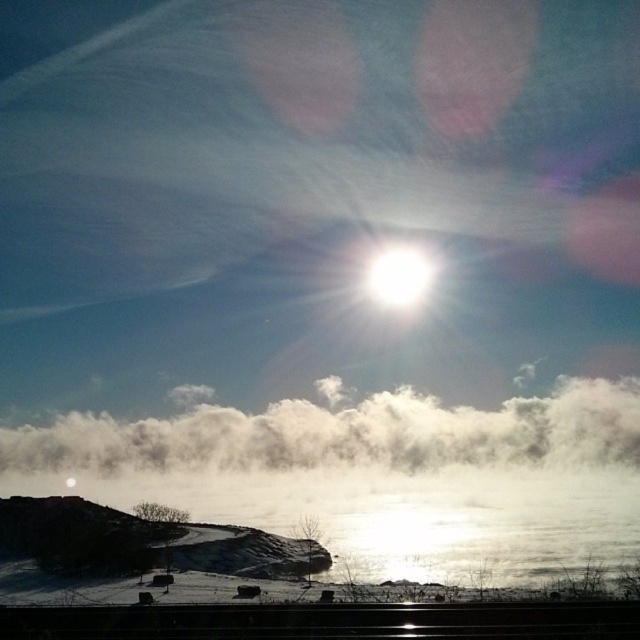
Question: Can you confirm if white fluffy cloud at center is wider than white glossy sun at upper center?

Choices:
 (A) yes
 (B) no

Answer: (A)

Question: Does white fluffy cloud at center have a smaller size compared to white glossy sun at upper center?

Choices:
 (A) no
 (B) yes

Answer: (A)

Question: Among these objects, which one is nearest to the camera?

Choices:
 (A) white fluffy cloud at center
 (B) white glossy sun at upper center

Answer: (A)

Question: Which point is closer to the camera?

Choices:
 (A) white fluffy cloud at center
 (B) white glossy sun at upper center

Answer: (A)

Question: Does white fluffy cloud at center lie in front of white glossy sun at upper center?

Choices:
 (A) yes
 (B) no

Answer: (A)